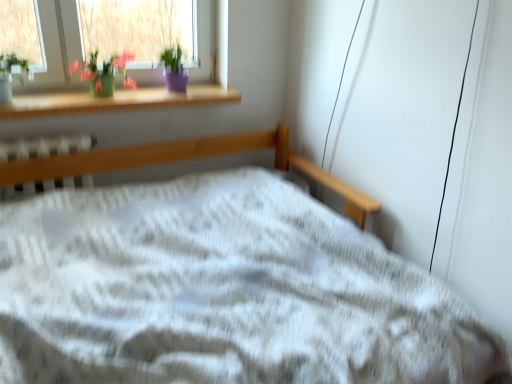
Where is `vacant space underneath green matte vase at upper left (from a real-world perspective)`? The width and height of the screenshot is (512, 384). vacant space underneath green matte vase at upper left (from a real-world perspective) is located at coordinates (113, 102).